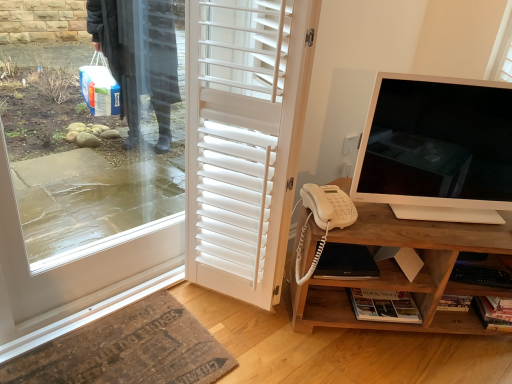
Question: Considering the relative sizes of rug at lower left and wooden cabinet at right in the image provided, is rug at lower left smaller than wooden cabinet at right?

Choices:
 (A) no
 (B) yes

Answer: (B)

Question: From a real-world perspective, is rug at lower left over wooden cabinet at right?

Choices:
 (A) no
 (B) yes

Answer: (A)

Question: Is rug at lower left positioned with its back to wooden cabinet at right?

Choices:
 (A) yes
 (B) no

Answer: (B)

Question: Does rug at lower left touch wooden cabinet at right?

Choices:
 (A) yes
 (B) no

Answer: (B)

Question: Does rug at lower left have a lesser height compared to wooden cabinet at right?

Choices:
 (A) no
 (B) yes

Answer: (B)

Question: Is rug at lower left outside wooden cabinet at right?

Choices:
 (A) no
 (B) yes

Answer: (B)

Question: From a real-world perspective, is white glossy monitor at right positioned over wooden cabinet at right based on gravity?

Choices:
 (A) yes
 (B) no

Answer: (A)

Question: Can you confirm if white glossy monitor at right is taller than wooden cabinet at right?

Choices:
 (A) yes
 (B) no

Answer: (A)

Question: From the image's perspective, is white glossy monitor at right on top of wooden cabinet at right?

Choices:
 (A) yes
 (B) no

Answer: (A)

Question: Is wooden cabinet at right located within white glossy monitor at right?

Choices:
 (A) yes
 (B) no

Answer: (B)

Question: Is white glossy monitor at right behind wooden cabinet at right?

Choices:
 (A) no
 (B) yes

Answer: (A)

Question: Does white glossy monitor at right have a smaller size compared to wooden cabinet at right?

Choices:
 (A) no
 (B) yes

Answer: (B)

Question: Would you consider rug at lower left to be distant from black matte laptop at lower center?

Choices:
 (A) no
 (B) yes

Answer: (A)